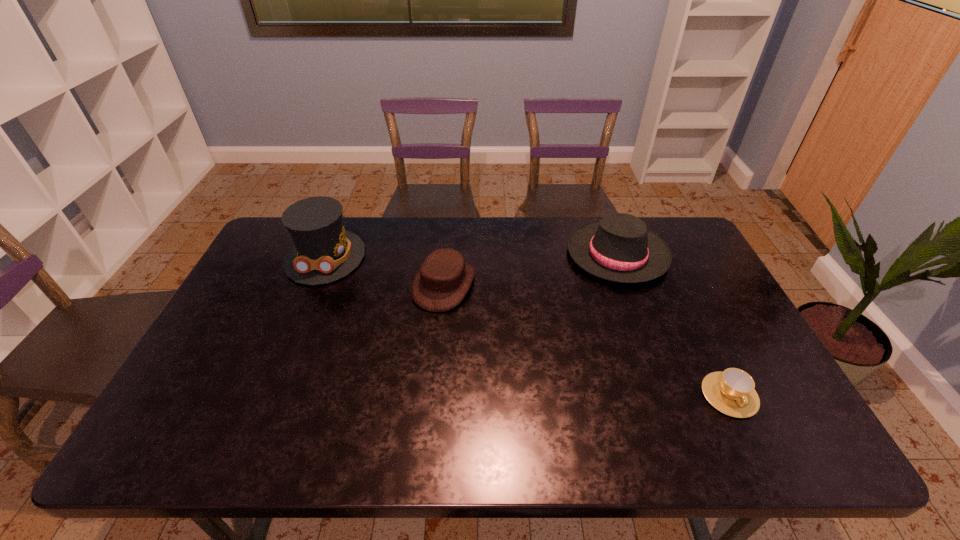
This screenshot has width=960, height=540. What are the coordinates of `vacant space at the far left corner of the desktop` in the screenshot? It's located at (270, 245).

The image size is (960, 540). What are the coordinates of `vacant area at the far right corner` in the screenshot? It's located at (660, 231).

Where is `free space between the second tallest hat and the third object from right to left`? The height and width of the screenshot is (540, 960). free space between the second tallest hat and the third object from right to left is located at coordinates (531, 269).

Identify the location of free space between the third shortest object and the second shortest object. (531, 269).

Locate an element on the screen. free area in between the shortest hat and the rightmost hat is located at coordinates (531, 269).

Locate an element on the screen. The width and height of the screenshot is (960, 540). vacant region between the second shortest hat and the shortest hat is located at coordinates (531, 269).

Find the location of a particular element. free spot between the rightmost hat and the leftmost object is located at coordinates (471, 256).

At what (x,y) coordinates should I click in order to perform the action: click on vacant region between the third shortest object and the tallest object. Please return your answer as a coordinate pair (x, y). The width and height of the screenshot is (960, 540). Looking at the image, I should click on (471, 256).

Where is `empty location between the second shortest object and the leftmost object`? This screenshot has width=960, height=540. empty location between the second shortest object and the leftmost object is located at coordinates (385, 271).

Where is `vacant area that lies between the shortest object and the second hat from right to left`? vacant area that lies between the shortest object and the second hat from right to left is located at coordinates (x=587, y=340).